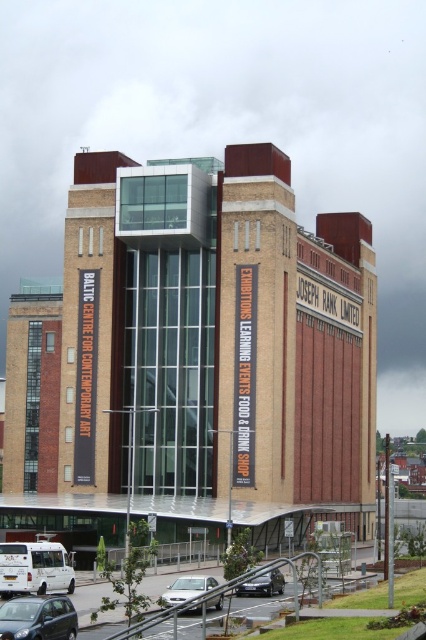
Does metallic gray hatchback at lower left have a greater width compared to metallic silver van at center?

In fact, metallic gray hatchback at lower left might be narrower than metallic silver van at center.

Image resolution: width=426 pixels, height=640 pixels. Identify the location of metallic gray hatchback at lower left. (37, 618).

Measure the distance between point (71, 616) and camera.

They are 42.63 meters apart.

Identify the location of metallic gray hatchback at lower left. The height and width of the screenshot is (640, 426). tap(37, 618).

Who is more forward, [13,627] or [192,592]?

Point [13,627] is more forward.

Is metallic gray hatchback at lower left below silver metallic sedan at lower center?

Actually, metallic gray hatchback at lower left is above silver metallic sedan at lower center.

Locate an element on the screen. metallic gray hatchback at lower left is located at coordinates (37, 618).

Does silver metallic sedan at lower center have a smaller size compared to metallic silver van at center?

No, silver metallic sedan at lower center is not smaller than metallic silver van at center.

Is silver metallic sedan at lower center to the right of metallic silver van at center from the viewer's perspective?

In fact, silver metallic sedan at lower center is to the left of metallic silver van at center.

Find the location of a particular element. silver metallic sedan at lower center is located at coordinates (187, 588).